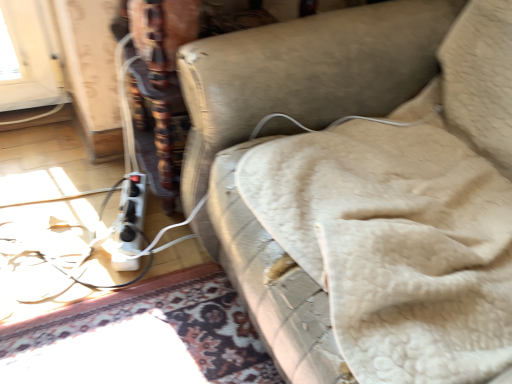
Question: Should I look upward or downward to see leather couch at center?

Choices:
 (A) up
 (B) down

Answer: (A)

Question: Is leather couch at center beside white plastic extension cord at lower left?

Choices:
 (A) no
 (B) yes

Answer: (A)

Question: Considering the relative positions of leather couch at center and white plastic extension cord at lower left in the image provided, is leather couch at center to the right of white plastic extension cord at lower left from the viewer's perspective?

Choices:
 (A) yes
 (B) no

Answer: (A)

Question: Can you confirm if leather couch at center is positioned to the left of white plastic extension cord at lower left?

Choices:
 (A) no
 (B) yes

Answer: (A)

Question: From the image's perspective, is leather couch at center located beneath white plastic extension cord at lower left?

Choices:
 (A) no
 (B) yes

Answer: (A)

Question: Is leather couch at center wider than white plastic extension cord at lower left?

Choices:
 (A) no
 (B) yes

Answer: (B)

Question: Can you confirm if leather couch at center is smaller than white plastic extension cord at lower left?

Choices:
 (A) no
 (B) yes

Answer: (A)

Question: Is white plastic extension cord at lower left with leather couch at center?

Choices:
 (A) no
 (B) yes

Answer: (A)

Question: From the image's perspective, is white plastic extension cord at lower left on top of leather couch at center?

Choices:
 (A) yes
 (B) no

Answer: (B)

Question: Is white plastic extension cord at lower left oriented away from leather couch at center?

Choices:
 (A) yes
 (B) no

Answer: (B)

Question: Is white plastic extension cord at lower left far from leather couch at center?

Choices:
 (A) no
 (B) yes

Answer: (A)

Question: Can you confirm if white plastic extension cord at lower left is smaller than leather couch at center?

Choices:
 (A) yes
 (B) no

Answer: (A)

Question: Is white plastic extension cord at lower left to the left of leather couch at center from the viewer's perspective?

Choices:
 (A) no
 (B) yes

Answer: (B)

Question: From their relative heights in the image, would you say leather couch at center is taller or shorter than white plastic extension cord at lower left?

Choices:
 (A) short
 (B) tall

Answer: (B)